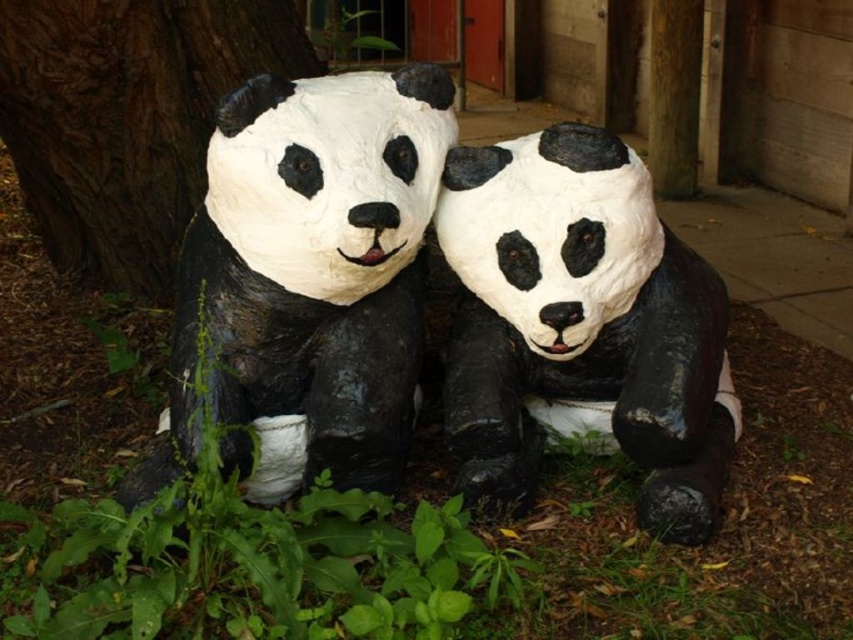
Between point (152, 496) and point (305, 32), which one is positioned behind?

Positioned behind is point (305, 32).

Does matte papier-mâché panda at center lie in front of brown rough bark at left?

That is True.

Who is more forward, (332, 272) or (102, 132)?

Point (332, 272) is more forward.

Locate an element on the screen. matte papier-mâché panda at center is located at coordinates (308, 280).

Which is in front, point (252, 481) or point (618, 388)?

Point (252, 481)

Is matte papier-mâché panda at center smaller than black matte/paper mache panda at center?

Actually, matte papier-mâché panda at center might be larger than black matte/paper mache panda at center.

Where is `matte papier-mâché panda at center`? This screenshot has width=853, height=640. matte papier-mâché panda at center is located at coordinates (308, 280).

Which is behind, point (704, 492) or point (78, 262)?

The point (78, 262) is more distant.

Which is in front, point (468, 371) or point (184, 12)?

Point (468, 371) is more forward.

What are the coordinates of `black matte/paper mache panda at center` in the screenshot? It's located at (582, 323).